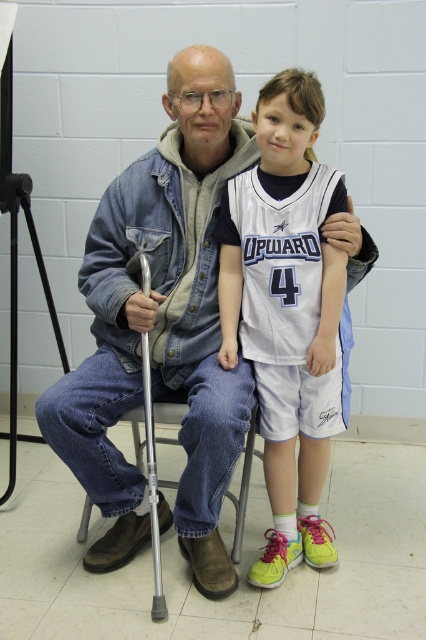
You are a photographer setting up for a group photo. You see the denim jacket at center and the white jersey at center in the frame. Which one is located to the left side of the other?

The denim jacket at center is positioned on the left side of white jersey at center.

You are a tailor who needs to determine which clothing item requires more fabric to alter. The denim jacket at center and the white jersey at center are both in need of adjustments. Based on their sizes, which one likely needs more fabric?

The denim jacket at center has a larger size compared to the white jersey at center, so it likely requires more fabric for alterations.

From the picture: You are a physical therapist helping the older man practice walking. The older man needs to reach the white jersey at center from his current position near the silver metallic crutch at left. Can he reach it without moving his feet?

The white jersey at center is 14.83 inches away from the silver metallic crutch at left. Since the distance is relatively short, the older man can likely reach the white jersey at center without needing to move his feet.